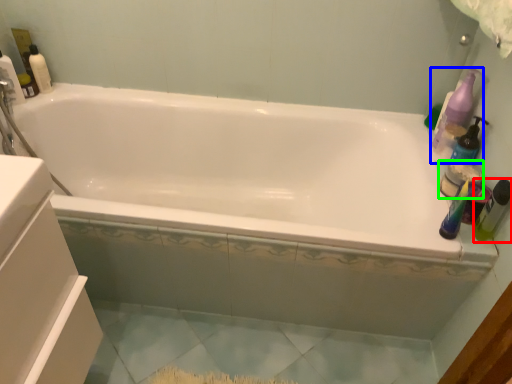
Question: Which object is positioned farthest from toiletry (highlighted by a red box)? Select from cleaning product (highlighted by a blue box) and toiletry (highlighted by a green box).

Choices:
 (A) cleaning product
 (B) toiletry

Answer: (A)